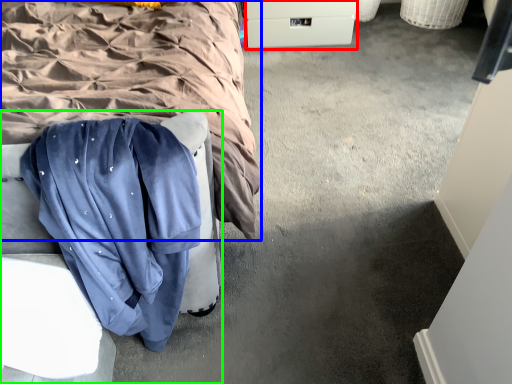
Question: Based on their relative distances, which object is nearer to drawer (highlighted by a red box)? Choose from bed (highlighted by a blue box) and furniture (highlighted by a green box).

Choices:
 (A) bed
 (B) furniture

Answer: (A)